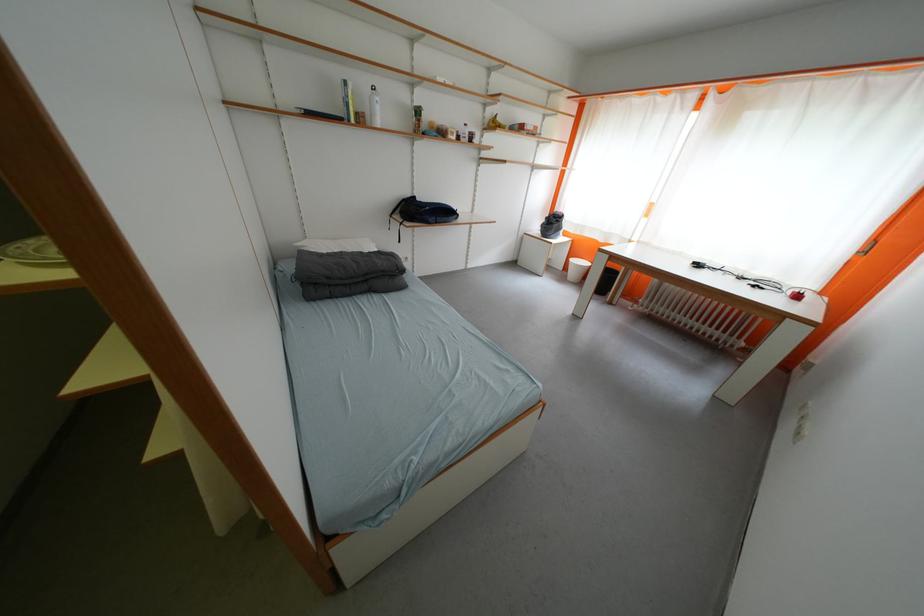
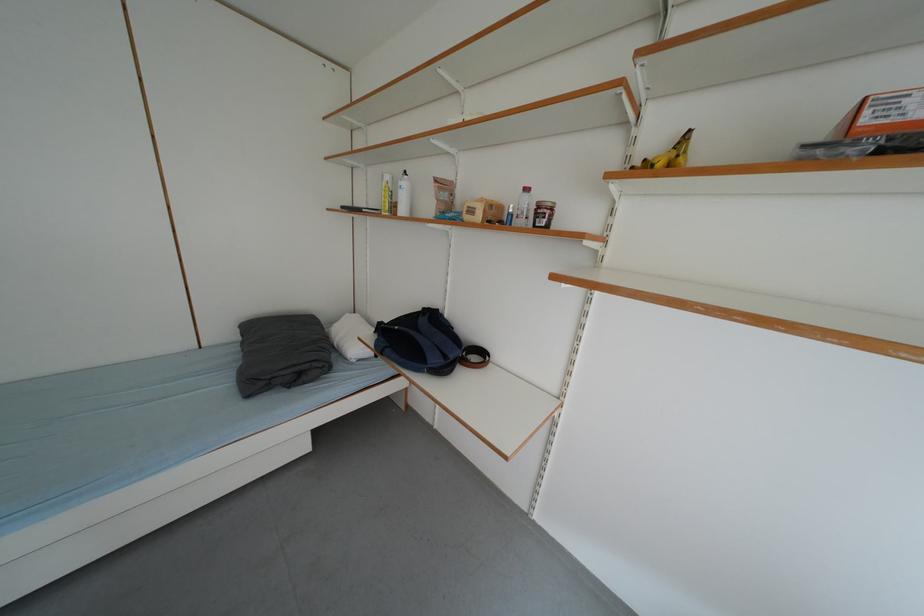
The point at (447, 222) is marked in the first image. Where is the corresponding point in the second image?

(396, 354)